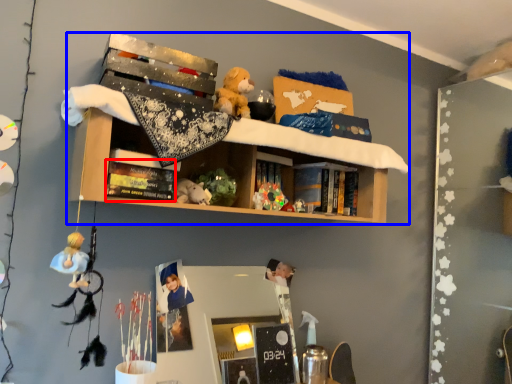
Question: Which of the following is the farthest to the observer, book (highlighted by a red box) or shelf (highlighted by a blue box)?

Choices:
 (A) book
 (B) shelf

Answer: (A)